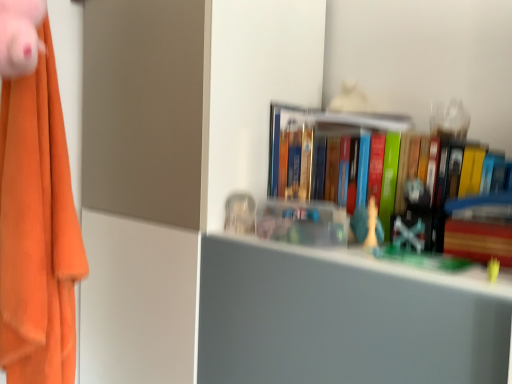
Question: From a real-world perspective, is orange fabric at left positioned over wooden paperback book at right based on gravity?

Choices:
 (A) yes
 (B) no

Answer: (A)

Question: Is orange fabric at left further to camera compared to wooden paperback book at right?

Choices:
 (A) yes
 (B) no

Answer: (A)

Question: Does orange fabric at left have a lesser width compared to wooden paperback book at right?

Choices:
 (A) no
 (B) yes

Answer: (A)

Question: Does orange fabric at left have a greater height compared to wooden paperback book at right?

Choices:
 (A) yes
 (B) no

Answer: (A)

Question: Is orange fabric at left directly adjacent to wooden paperback book at right?

Choices:
 (A) no
 (B) yes

Answer: (A)

Question: Would you say orange fabric at left is outside wooden paperback book at right?

Choices:
 (A) yes
 (B) no

Answer: (A)

Question: Is white plastic chess piece at center, which is the third toy in left-to-right order, behind orange fabric at left?

Choices:
 (A) no
 (B) yes

Answer: (B)

Question: From a real-world perspective, is white plastic chess piece at center, which is the first toy from right to left, physically above orange fabric at left?

Choices:
 (A) no
 (B) yes

Answer: (A)

Question: From a real-world perspective, does white plastic chess piece at center, the 2th toy viewed from the back, sit lower than orange fabric at left?

Choices:
 (A) yes
 (B) no

Answer: (A)

Question: Are white plastic chess piece at center, arranged as the third toy when viewed from the top, and orange fabric at left beside each other?

Choices:
 (A) no
 (B) yes

Answer: (A)

Question: From the image's perspective, is white plastic chess piece at center, the 2th toy positioned from the front, below orange fabric at left?

Choices:
 (A) yes
 (B) no

Answer: (A)

Question: Does white plastic chess piece at center, arranged as the third toy when viewed from the top, have a greater width compared to orange fabric at left?

Choices:
 (A) no
 (B) yes

Answer: (A)

Question: Is white plastic chess piece at center, arranged as the third toy when viewed from the top, facing towards clear plastic container at center, placed as the second toy when sorted from bottom to top?

Choices:
 (A) yes
 (B) no

Answer: (B)